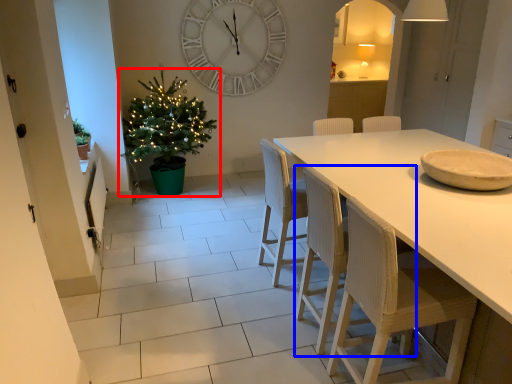
Question: Which object appears closest to the camera in this image, christmas tree (highlighted by a red box) or chair (highlighted by a blue box)?

Choices:
 (A) christmas tree
 (B) chair

Answer: (B)